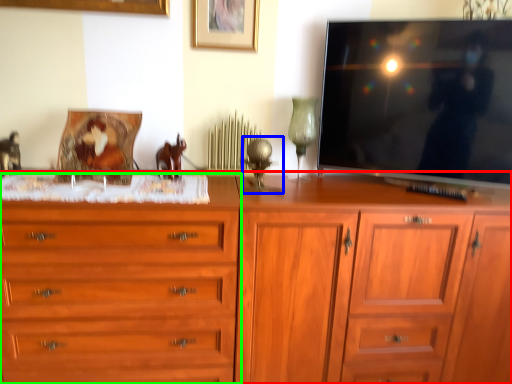
Question: Estimate the real-world distances between objects in this image. Which object is farther from chest of drawers (highlighted by a red box), table lamp (highlighted by a blue box) or chest of drawers (highlighted by a green box)?

Choices:
 (A) table lamp
 (B) chest of drawers

Answer: (A)